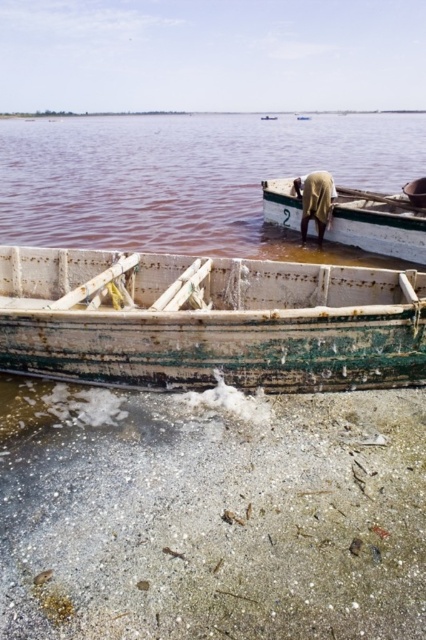
Question: Can you confirm if white sandy shore at lower center is wider than brown fabric cloth at center?

Choices:
 (A) yes
 (B) no

Answer: (A)

Question: Can you confirm if white sandy shore at lower center is positioned to the right of pink water at center?

Choices:
 (A) yes
 (B) no

Answer: (B)

Question: Which object is positioned closest to the rusty wood boat at lower center?

Choices:
 (A) rusty wood boat at center
 (B) white sandy shore at lower center

Answer: (B)

Question: Estimate the real-world distances between objects in this image. Which object is farther from the white sandy shore at lower center?

Choices:
 (A) brown fabric cloth at center
 (B) pink water at center
 (C) rusty wood boat at center
 (D) rusty wood boat at lower center

Answer: (B)

Question: Which point appears closest to the camera in this image?

Choices:
 (A) (189, 172)
 (B) (400, 452)
 (C) (282, 205)

Answer: (B)

Question: From the image, what is the correct spatial relationship of pink water at center in relation to brown fabric cloth at center?

Choices:
 (A) left
 (B) right

Answer: (B)